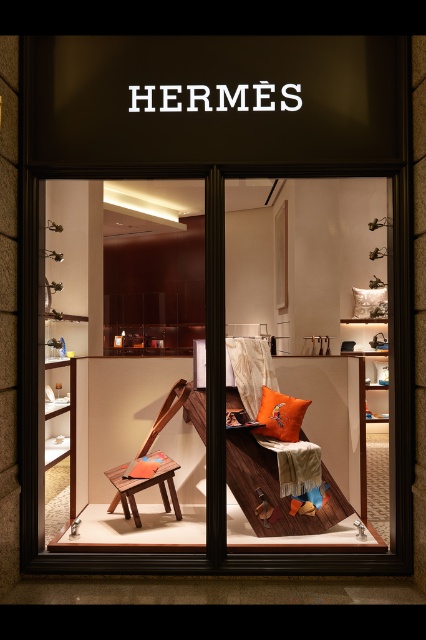
You are sitting on the wooden bench at center and want to reach the orange fabric cushion at center. In which direction should you move to get closer to it?

The wooden bench at center is positioned on the left side of the orange fabric cushion at center, so you should move to the right to get closer to the orange fabric cushion at center.

You are a customer entering the Hermes store and want to sit down to rest. You see the wooden bench at center and the orange fabric cushion at center. Which one is shorter and thus more suitable for sitting?

The wooden bench at center is not as tall as the orange fabric cushion at center, so the wooden bench at center is shorter and more suitable for sitting.